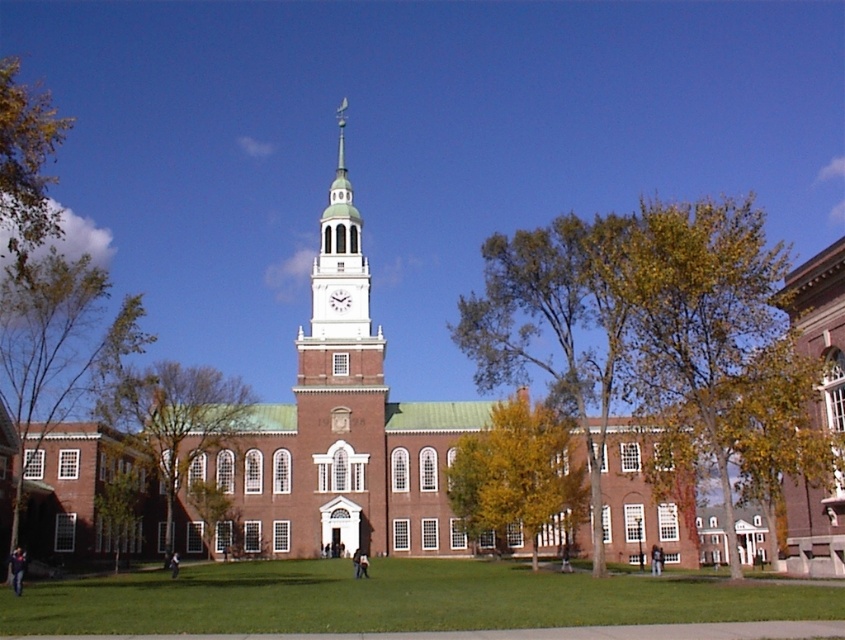
You are standing at the entrance of the grand historic building and want to reach the green leafy tree at center. Which direction should you walk to get there?

The green leafy tree at center is located at point 0.653 on the x axis and 0.206 on the y axis. Since the tree is at the center of the image, you should walk straight ahead from the entrance to reach it.